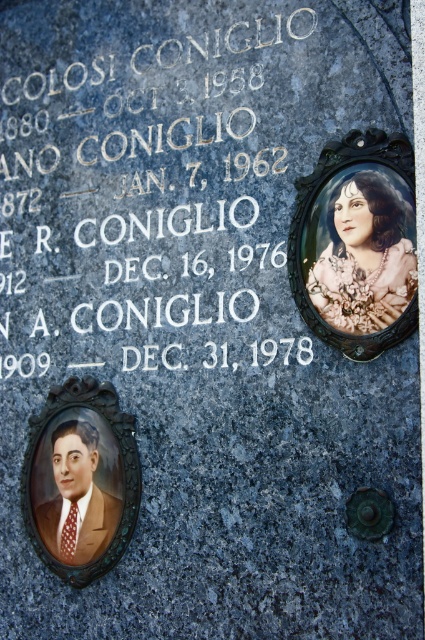
Which is more to the left, white granite stone at center or matte brown suit at lower left?

matte brown suit at lower left is more to the left.

Who is more forward, [150,84] or [85,433]?

Positioned in front is point [85,433].

I want to click on white granite stone at center, so click(x=153, y=180).

Is pastel floral dress at upper right bigger than matte brown suit at lower left?

No, pastel floral dress at upper right is not bigger than matte brown suit at lower left.

Which is behind, point (320, 237) or point (68, 477)?

Positioned behind is point (68, 477).

Image resolution: width=425 pixels, height=640 pixels. Describe the element at coordinates (362, 252) in the screenshot. I see `pastel floral dress at upper right` at that location.

This screenshot has width=425, height=640. In order to click on pastel floral dress at upper right in this screenshot , I will do `click(362, 252)`.

Which is in front, point (291, 12) or point (396, 241)?

Point (396, 241) is in front.

Where is `white granite stone at center`? This screenshot has width=425, height=640. white granite stone at center is located at coordinates (153, 180).